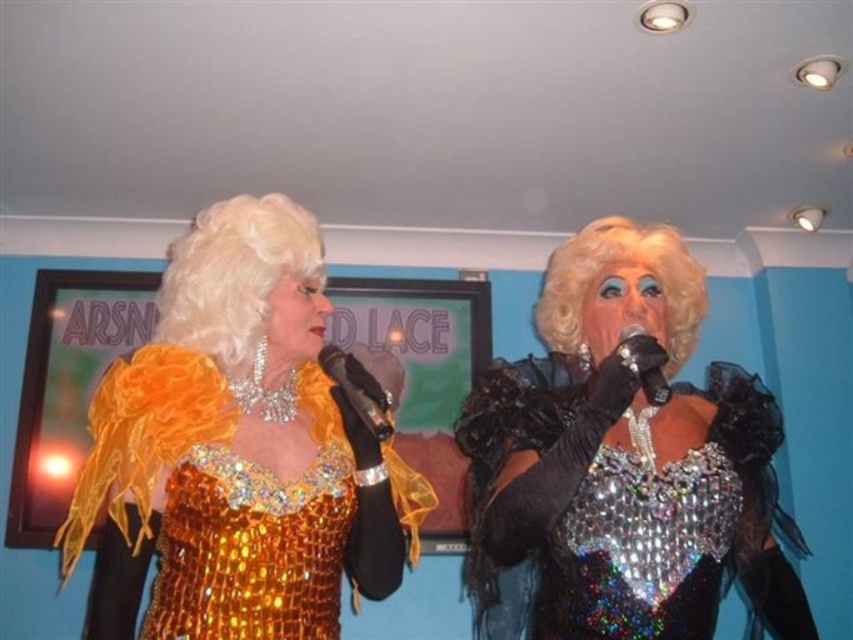
Question: Which object is the closest to the sparkly silver dress at center?

Choices:
 (A) black metallic microphone at center
 (B) metallic silver microphone at center
 (C) shiny blonde wig at upper left

Answer: (B)

Question: Where is sparkly silver dress at center located in relation to black metallic microphone at center in the image?

Choices:
 (A) below
 (B) above

Answer: (A)

Question: Which object is farther from the camera taking this photo?

Choices:
 (A) sparkly silver dress at center
 (B) shiny blonde wig at upper left

Answer: (B)

Question: Can you confirm if shiny gold dress at left is positioned below metallic silver microphone at center?

Choices:
 (A) no
 (B) yes

Answer: (B)

Question: Considering the relative positions of shiny blonde wig at upper left and metallic silver microphone at center in the image provided, where is shiny blonde wig at upper left located with respect to metallic silver microphone at center?

Choices:
 (A) below
 (B) above

Answer: (B)

Question: Based on their relative distances, which object is nearer to the sparkly silver dress at center?

Choices:
 (A) blondehair/fabric wig at center
 (B) black metallic microphone at center
 (C) shiny gold dress at left
 (D) shiny blonde wig at upper left

Answer: (A)